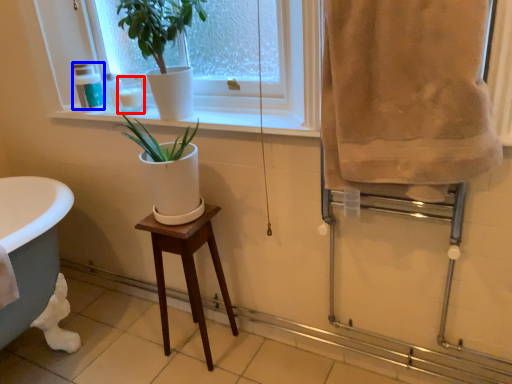
Question: Among these objects, which one is nearest to the camera, toiletry (highlighted by a red box) or toiletry (highlighted by a blue box)?

Choices:
 (A) toiletry
 (B) toiletry

Answer: (A)